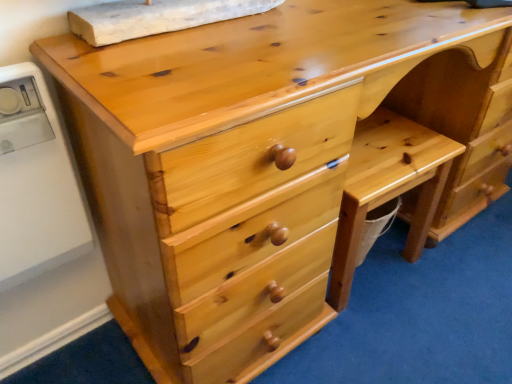
The height and width of the screenshot is (384, 512). What do you see at coordinates (388, 187) in the screenshot?
I see `natural wood chair at lower right` at bounding box center [388, 187].

Locate an element on the screen. This screenshot has width=512, height=384. natural wood chair at lower right is located at coordinates (388, 187).

The width and height of the screenshot is (512, 384). What do you see at coordinates (35, 182) in the screenshot?
I see `white plastic appliance at left` at bounding box center [35, 182].

At what (x,y) coordinates should I click in order to perform the action: click on white plastic appliance at left. Please return your answer as a coordinate pair (x, y). This screenshot has width=512, height=384. Looking at the image, I should click on (35, 182).

At what (x,y) coordinates should I click in order to perform the action: click on natural wood chair at lower right. Please return your answer as a coordinate pair (x, y). The height and width of the screenshot is (384, 512). Looking at the image, I should click on (388, 187).

In the image, is white plastic appliance at left on the left side or the right side of natural wood chair at lower right?

From the image, it's evident that white plastic appliance at left is to the left of natural wood chair at lower right.

Which object is closer to the camera taking this photo, white plastic appliance at left or natural wood chair at lower right?

white plastic appliance at left is in front.

Which point is more distant from viewer, (3, 201) or (443, 159)?

Point (443, 159)

From the image's perspective, which one is positioned lower, white plastic appliance at left or natural wood chair at lower right?

natural wood chair at lower right is shown below in the image.

From a real-world perspective, is white plastic appliance at left positioned under natural wood chair at lower right based on gravity?

Actually, white plastic appliance at left is physically above natural wood chair at lower right in the real world.

Considering the sizes of objects white plastic appliance at left and natural wood chair at lower right in the image provided, who is wider, white plastic appliance at left or natural wood chair at lower right?

natural wood chair at lower right.

Which of these two, white plastic appliance at left or natural wood chair at lower right, stands shorter?

natural wood chair at lower right.

Considering the relative sizes of white plastic appliance at left and natural wood chair at lower right in the image provided, is white plastic appliance at left smaller than natural wood chair at lower right?

Yes, white plastic appliance at left is smaller than natural wood chair at lower right.

Would you say white plastic appliance at left contains natural wood chair at lower right?

→ That's incorrect, natural wood chair at lower right is not inside white plastic appliance at left.

Is white plastic appliance at left in contact with natural wood chair at lower right?

No, white plastic appliance at left is not with natural wood chair at lower right.

Could you tell me if white plastic appliance at left is turned towards natural wood chair at lower right?

No, white plastic appliance at left does not turn towards natural wood chair at lower right.

Consider the image. What's the angular difference between white plastic appliance at left and natural wood chair at lower right's facing directions?

The facing directions of white plastic appliance at left and natural wood chair at lower right are 5.15 degrees apart.

How far apart are white plastic appliance at left and natural wood chair at lower right?

white plastic appliance at left and natural wood chair at lower right are 26.73 inches apart from each other.

There is a natural wood chair at lower right. At what (x,y) coordinates should I click in order to perform the action: click on appliance above it (from a real-world perspective). Please return your answer as a coordinate pair (x, y). The height and width of the screenshot is (384, 512). Looking at the image, I should click on (35, 182).

Which object is positioned more to the left, natural wood chair at lower right or white plastic appliance at left?

From the viewer's perspective, white plastic appliance at left appears more on the left side.

Is natural wood chair at lower right further to the viewer compared to white plastic appliance at left?

Yes, the depth of natural wood chair at lower right is greater than that of white plastic appliance at left.

Is point (342, 234) positioned after point (49, 111)?

Yes, it is behind point (49, 111).

Consider the image. From the image's perspective, relative to white plastic appliance at left, is natural wood chair at lower right above or below?

From the image's perspective, natural wood chair at lower right appears below white plastic appliance at left.

From a real-world perspective, is natural wood chair at lower right physically located above or below white plastic appliance at left?

natural wood chair at lower right is below white plastic appliance at left.

Is natural wood chair at lower right wider or thinner than white plastic appliance at left?

In the image, natural wood chair at lower right appears to be wider than white plastic appliance at left.

In terms of height, does natural wood chair at lower right look taller or shorter compared to white plastic appliance at left?

natural wood chair at lower right is shorter than white plastic appliance at left.

Is natural wood chair at lower right smaller than white plastic appliance at left?

Incorrect, natural wood chair at lower right is not smaller in size than white plastic appliance at left.

Would you say natural wood chair at lower right contains white plastic appliance at left?

No, white plastic appliance at left is not a part of natural wood chair at lower right.

Can you see natural wood chair at lower right touching white plastic appliance at left?

No, natural wood chair at lower right is not in contact with white plastic appliance at left.

Is natural wood chair at lower right facing away from white plastic appliance at left?

No, white plastic appliance at left is not at the back of natural wood chair at lower right.

Can you tell me how much natural wood chair at lower right and white plastic appliance at left differ in facing direction?

natural wood chair at lower right and white plastic appliance at left are facing 5.15 degrees away from each other.

In the image, there is a white plastic appliance at left. Find the location of `cabinetry below it (from a real-world perspective)`. cabinetry below it (from a real-world perspective) is located at coordinates (388, 187).

This screenshot has height=384, width=512. In order to click on cabinetry lying on the right of white plastic appliance at left in this screenshot , I will do `click(388, 187)`.

Find the location of a particular element. This screenshot has height=384, width=512. cabinetry that is below the white plastic appliance at left (from the image's perspective) is located at coordinates (388, 187).